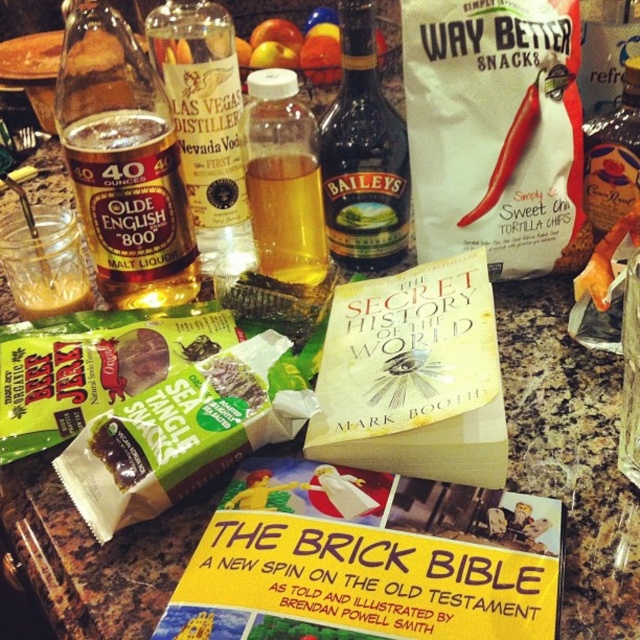
Question: Is the position of amber glass bottle at left more distant than that of gold glass bottle at center?

Choices:
 (A) yes
 (B) no

Answer: (B)

Question: Which point appears closest to the camera in this image?

Choices:
 (A) (220, 120)
 (B) (74, 38)
 (C) (292, 86)
 (D) (408, 177)

Answer: (C)

Question: Which of these objects is positioned closest to the clear glass nevada vodka bottle at center?

Choices:
 (A) dark brown glass bottle at center
 (B) amber glass bottle at left
 (C) translucent plastic bottle at center

Answer: (C)

Question: Which is nearer to the dark brown glass bottle at center?

Choices:
 (A) amber glass bottle at left
 (B) translucent plastic bottle at center

Answer: (B)

Question: From the image, what is the correct spatial relationship of clear glass nevada vodka bottle at center in relation to dark brown glass bottle at center?

Choices:
 (A) left
 (B) right

Answer: (A)

Question: Observing the image, what is the correct spatial positioning of amber glass bottle at left in reference to dark brown glass bottle at center?

Choices:
 (A) left
 (B) right

Answer: (A)